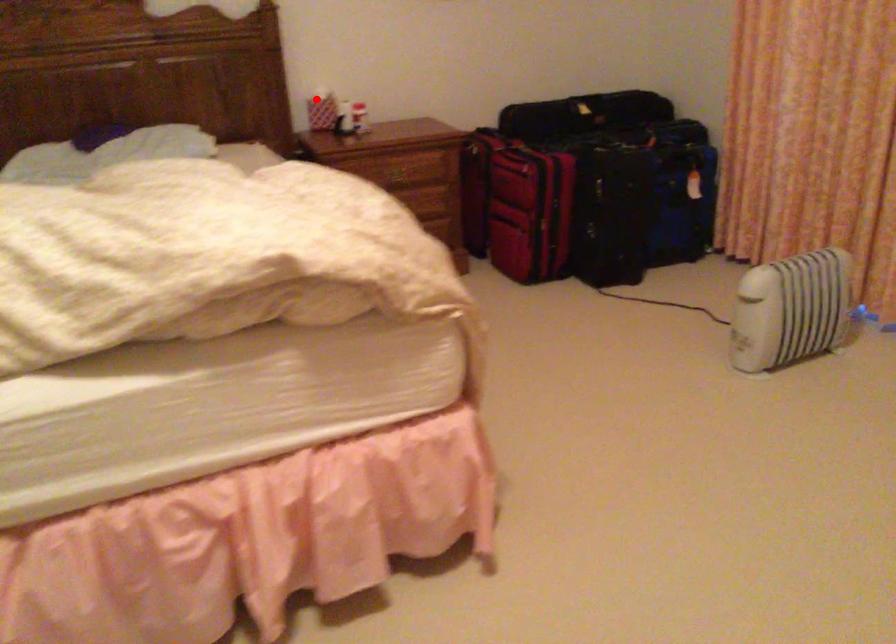
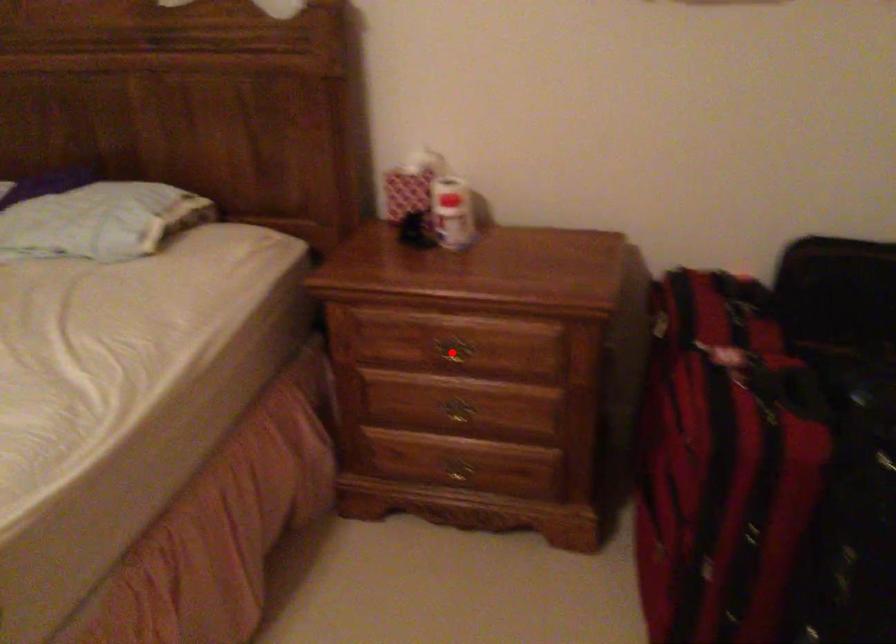
I am providing you with two images of the same scene from different viewpoints. A red point is marked on the first image and another point is marked on the second image. Is the marked point in image1 the same physical position as the marked point in image2?

No